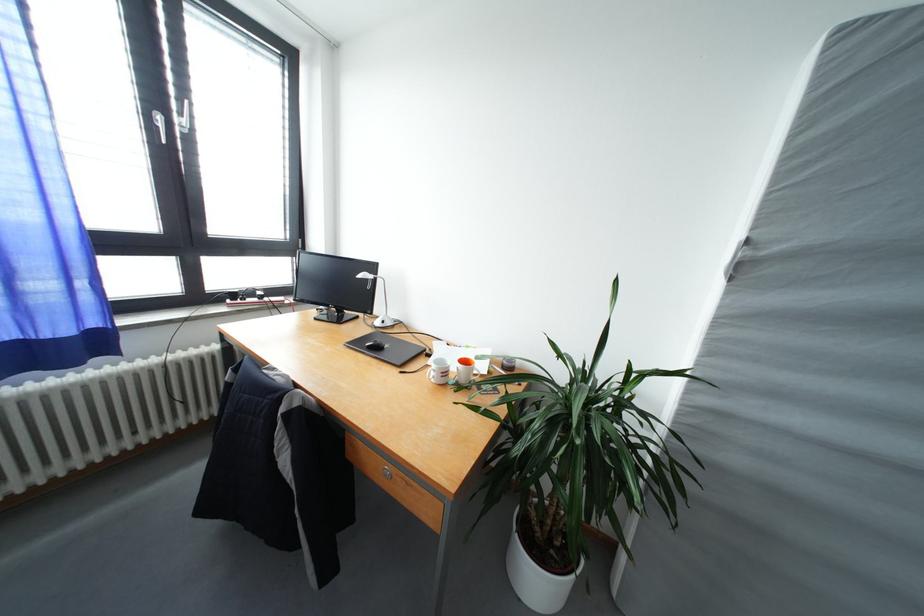
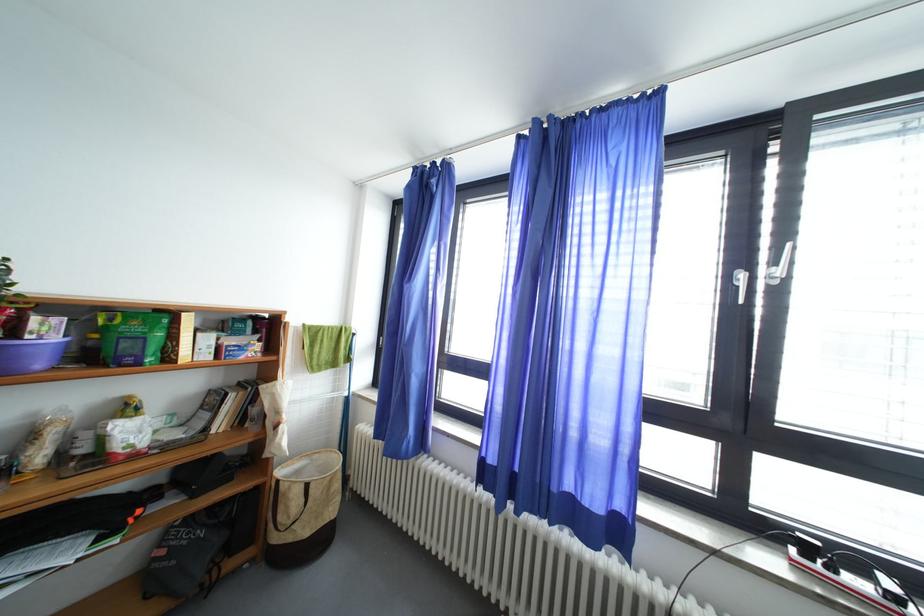
Question: The first image is from the beginning of the video and the second image is from the end. How did the camera likely rotate when shooting the video?

Choices:
 (A) Left
 (B) Right
 (C) Up
 (D) Down

Answer: (A)